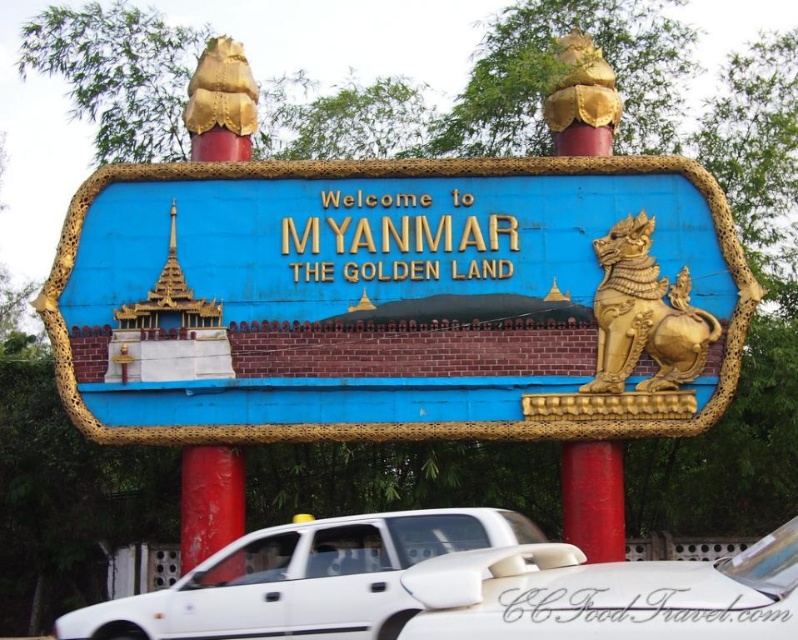
Question: Is white matte car at lower center to the right of red matte pole at center from the viewer's perspective?

Choices:
 (A) no
 (B) yes

Answer: (B)

Question: Which point appears closest to the camera in this image?

Choices:
 (A) (597, 588)
 (B) (326, 598)
 (C) (211, 522)

Answer: (A)

Question: Does white matte car at lower center have a lesser width compared to gold/gilded lion at right?

Choices:
 (A) yes
 (B) no

Answer: (B)

Question: Is gold/gilded lion at right behind red matte pole at center?

Choices:
 (A) yes
 (B) no

Answer: (A)

Question: Among these objects, which one is nearest to the camera?

Choices:
 (A) blue painted wood sign at center
 (B) white matte car at lower center

Answer: (B)

Question: Which of the following is the closest to the observer?

Choices:
 (A) gold/gilded lion at right
 (B) red painted pole at center
 (C) blue painted wood sign at center
 (D) white matte car at lower center

Answer: (D)